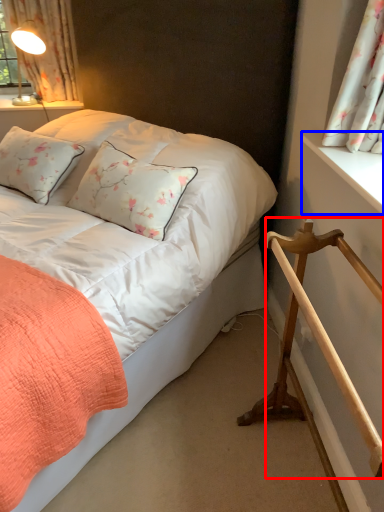
Question: Which point is further to the camera, rail (highlighted by a red box) or window sill (highlighted by a blue box)?

Choices:
 (A) rail
 (B) window sill

Answer: (B)